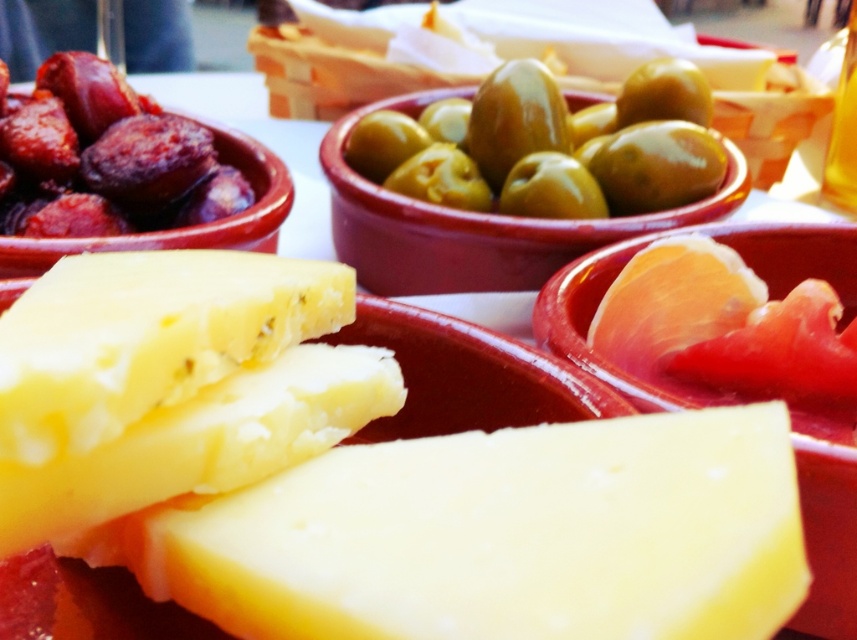
Question: Which object appears farthest from the camera in this image?

Choices:
 (A) yellow creamy cheese at center
 (B) shiny brown sausage at upper left
 (C) green glossy olives at center

Answer: (C)

Question: Which object is farther from the camera taking this photo?

Choices:
 (A) green glossy olives at center
 (B) yellow creamy cheese at center

Answer: (A)

Question: Which is farther from the yellow creamy cheese at center?

Choices:
 (A) shiny brown sausage at upper left
 (B) green glossy olives at center

Answer: (B)

Question: Is green glossy olives at center bigger than shiny brown sausage at upper left?

Choices:
 (A) yes
 (B) no

Answer: (A)

Question: Is yellow creamy cheese at center positioned before shiny brown sausage at upper left?

Choices:
 (A) yes
 (B) no

Answer: (A)

Question: Does yellow creamy cheese at center appear under green glossy olives at center?

Choices:
 (A) yes
 (B) no

Answer: (A)